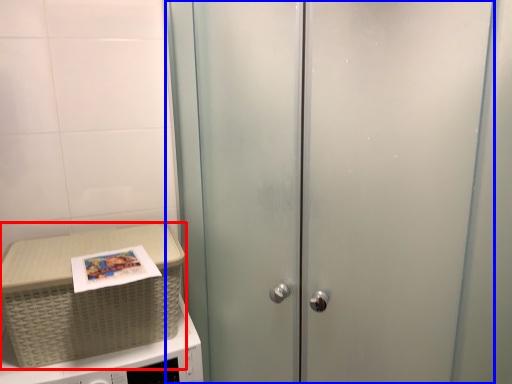
Question: Which object is further to the camera taking this photo, picnic basket (highlighted by a red box) or door (highlighted by a blue box)?

Choices:
 (A) picnic basket
 (B) door

Answer: (A)